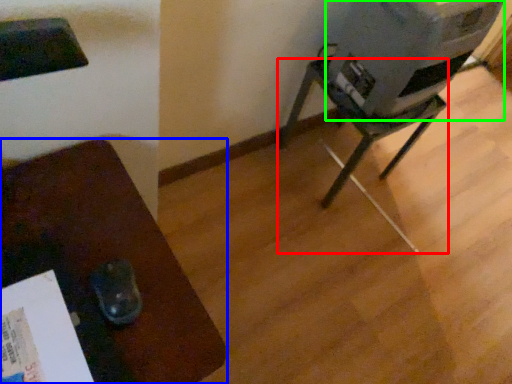
Question: Which object is positioned farthest from furniture (highlighted by a red box)? Select from furniture (highlighted by a blue box) and water cooler (highlighted by a green box).

Choices:
 (A) furniture
 (B) water cooler

Answer: (A)